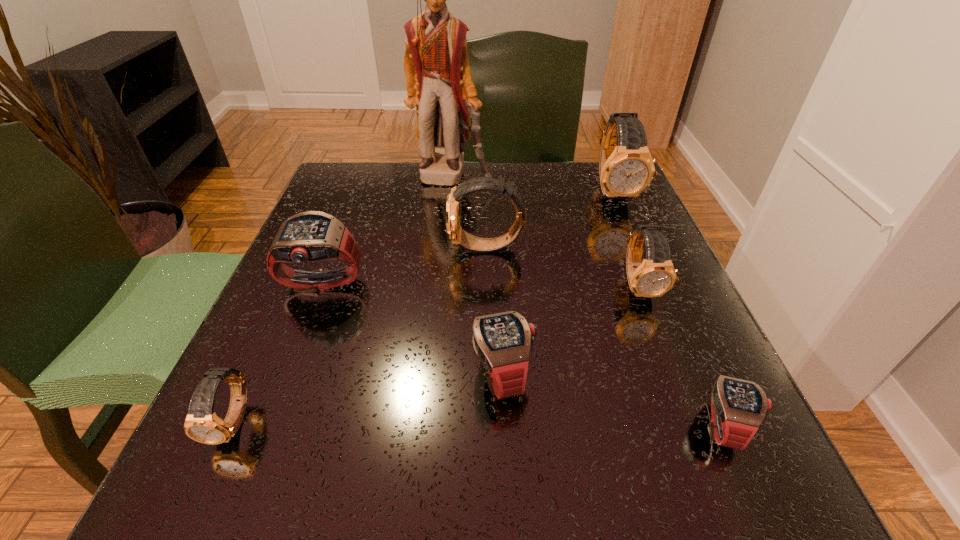
Where is `vacant space located on the face of the third biggest gold watch`? The image size is (960, 540). vacant space located on the face of the third biggest gold watch is located at coordinates (721, 497).

Where is `vacant space located on the back of the second red watch from left to right`? vacant space located on the back of the second red watch from left to right is located at coordinates (495, 217).

The width and height of the screenshot is (960, 540). Identify the location of free space located on the left of the rightmost red watch. (447, 426).

This screenshot has height=540, width=960. In order to click on nutcracker present at the far edge in this screenshot , I will do `click(436, 64)`.

Find the location of `watch that is at the far edge`. watch that is at the far edge is located at coordinates (626, 168).

At what (x,y) coordinates should I click in order to perform the action: click on object located at the near left corner. Please return your answer as a coordinate pair (x, y). Looking at the image, I should click on (202, 424).

In order to click on object located at the far right corner in this screenshot , I will do `click(626, 168)`.

The width and height of the screenshot is (960, 540). I want to click on object present at the near right corner, so click(738, 407).

Where is `vacant space at the far edge of the desktop`? The height and width of the screenshot is (540, 960). vacant space at the far edge of the desktop is located at coordinates (464, 179).

Locate an element on the screen. This screenshot has width=960, height=540. vacant space at the near edge is located at coordinates (434, 498).